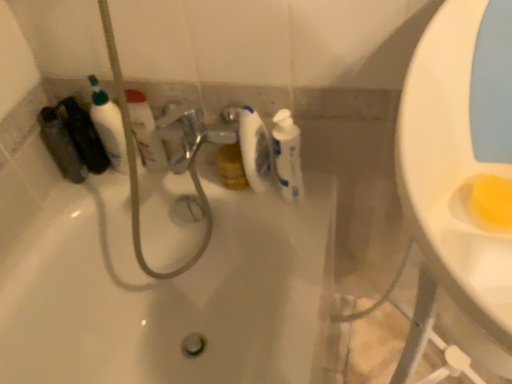
Where is `free space in front of white glossy bottle at center, marked as the first cleaning product in a right-to-left arrangement`? The width and height of the screenshot is (512, 384). free space in front of white glossy bottle at center, marked as the first cleaning product in a right-to-left arrangement is located at coordinates (301, 229).